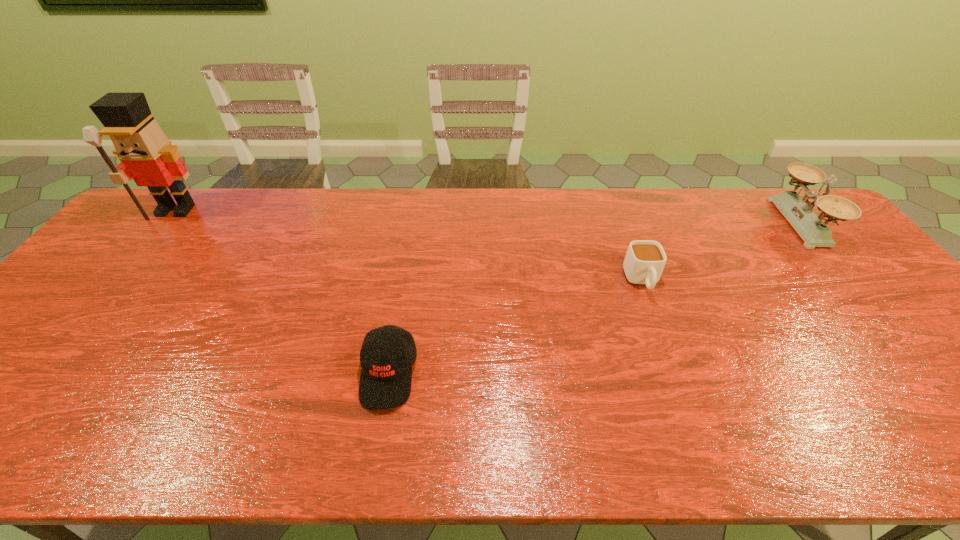
Identify the location of the tallest object. (146, 155).

You are a GUI agent. You are given a task and a screenshot of the screen. Output one action in this format:
    pyautogui.click(x=<x>, y=<y>)
    Task: Click on the leftmost object
    
    Given the screenshot: What is the action you would take?
    pyautogui.click(x=146, y=155)

Locate an element on the screen. This screenshot has width=960, height=540. the rightmost object is located at coordinates (797, 210).

Where is `scale`? This screenshot has height=540, width=960. scale is located at coordinates (797, 210).

The image size is (960, 540). I want to click on the second object from left to right, so click(385, 381).

Image resolution: width=960 pixels, height=540 pixels. I want to click on baseball cap, so click(385, 381).

The height and width of the screenshot is (540, 960). I want to click on cup, so click(644, 262).

Where is `the second nearest object`? Image resolution: width=960 pixels, height=540 pixels. the second nearest object is located at coordinates (644, 262).

You are a GUI agent. You are given a task and a screenshot of the screen. Output one action in this format:
    pyautogui.click(x=<x>, y=<y>)
    Task: Click on the vacant space located 0.240m in front of the tallest object holding the staff
    The image size is (960, 540).
    Given the screenshot: What is the action you would take?
    pyautogui.click(x=121, y=278)

Identify the location of vacant area situated 0.390m on the front-facing side of the scale. Image resolution: width=960 pixels, height=540 pixels. (660, 223).